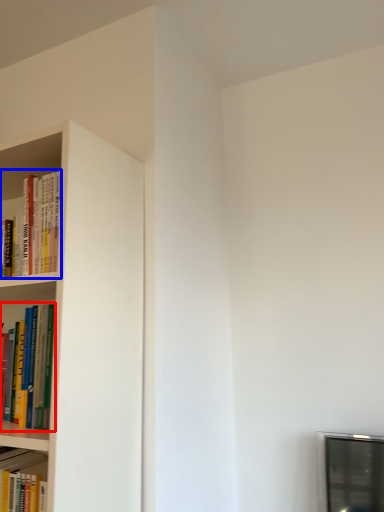
Question: Which point is further to the camera, book (highlighted by a red box) or book (highlighted by a blue box)?

Choices:
 (A) book
 (B) book

Answer: (B)